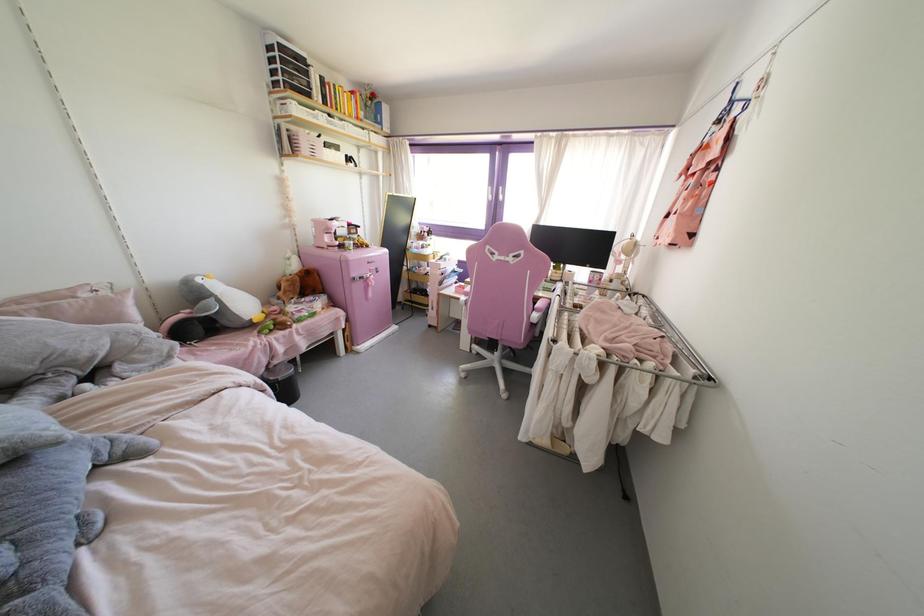
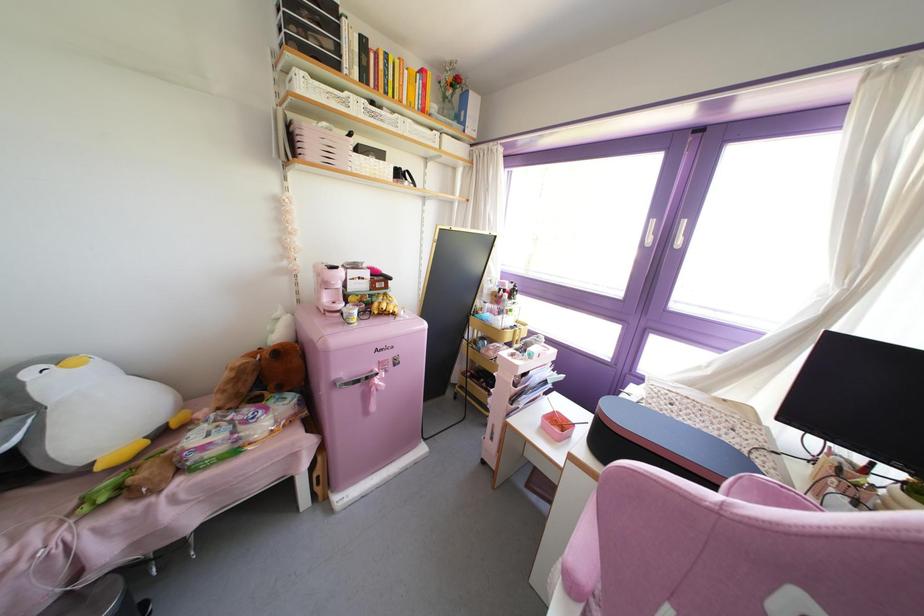
Find the pixel in the second image that matches pixel 436 257 in the first image.

(516, 345)